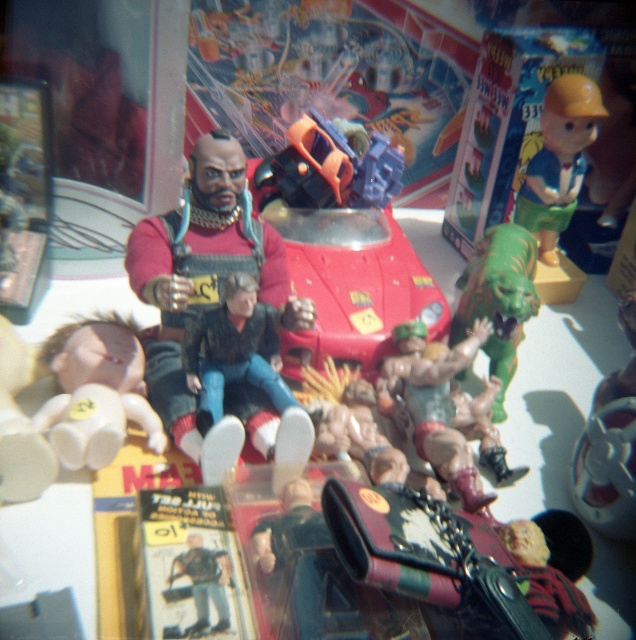
Who is more distant from viewer, (298, 323) or (501, 349)?

The point (501, 349) is behind.

Can you confirm if matte black figure at center is positioned to the right of green rubber toy at center?

Incorrect, matte black figure at center is not on the right side of green rubber toy at center.

The height and width of the screenshot is (640, 636). Identify the location of matte black figure at center. (212, 305).

Between point (410, 300) and point (527, 250), which one is positioned in front?

Positioned in front is point (410, 300).

Does metallic red car at center have a lesser height compared to green rubber toy at center?

In fact, metallic red car at center may be taller than green rubber toy at center.

Which is behind, point (370, 164) or point (527, 243)?

The point (370, 164) is more distant.

I want to click on metallic red car at center, so tap(343, 243).

Who is shorter, matte black figure at center or matte plastic toy at upper right?

With less height is matte plastic toy at upper right.

Does matte black figure at center lie behind matte plastic toy at upper right?

No, matte black figure at center is closer to the viewer.

Between point (261, 436) and point (551, 218), which one is positioned in front?

Positioned in front is point (261, 436).

Image resolution: width=636 pixels, height=640 pixels. I want to click on matte black figure at center, so click(212, 305).